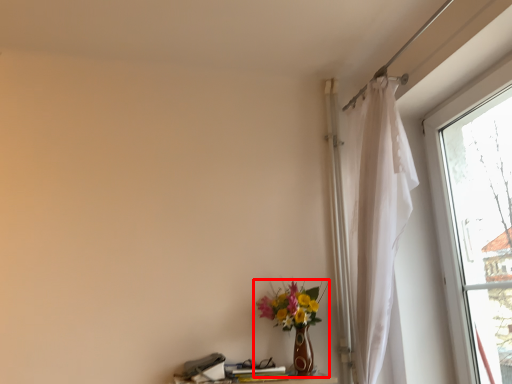
Question: From the image, what is the correct spatial relationship of houseplant (annotated by the red box) in relation to table?

Choices:
 (A) right
 (B) left

Answer: (A)